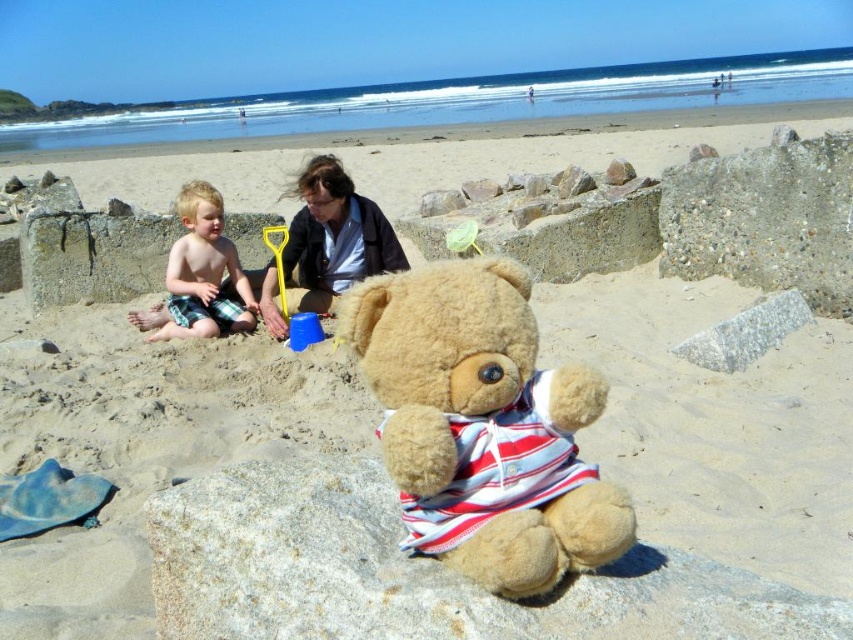
You are a photographer standing at the edge of the beach. You want to take a photo that includes both the smooth brown hair at center and the blonde hair boy at left without moving either subject. Given that your camera has a maximum focus range of 20 inches, will you be able to capture both subjects in focus?

The distance between the smooth brown hair at center and the blonde hair boy at left is 19.78 inches, which is within the camera maximum focus range of 20 inches. Therefore, you can capture both subjects in focus.